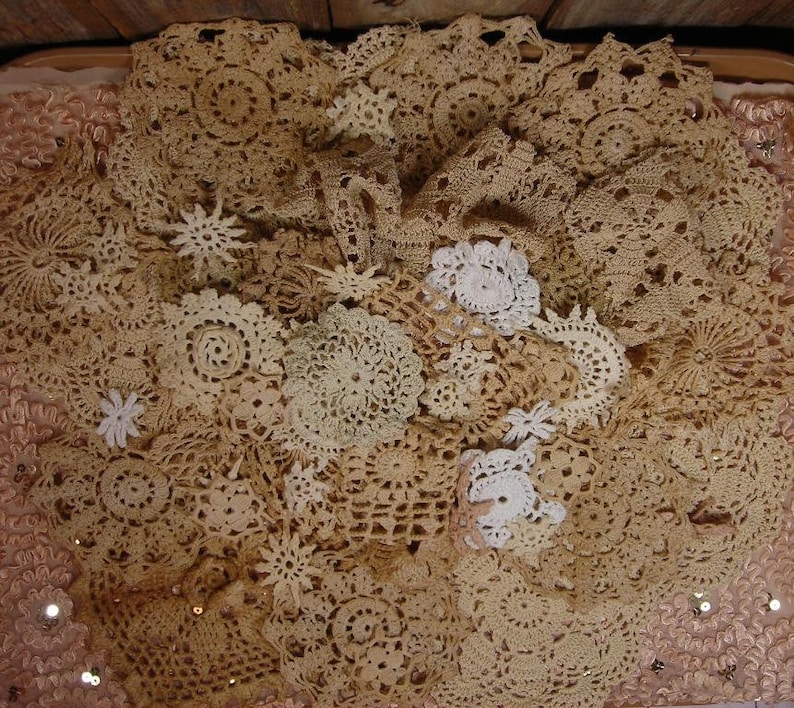
Identify the location of wood panel wall. This screenshot has height=708, width=794. (615, 4).